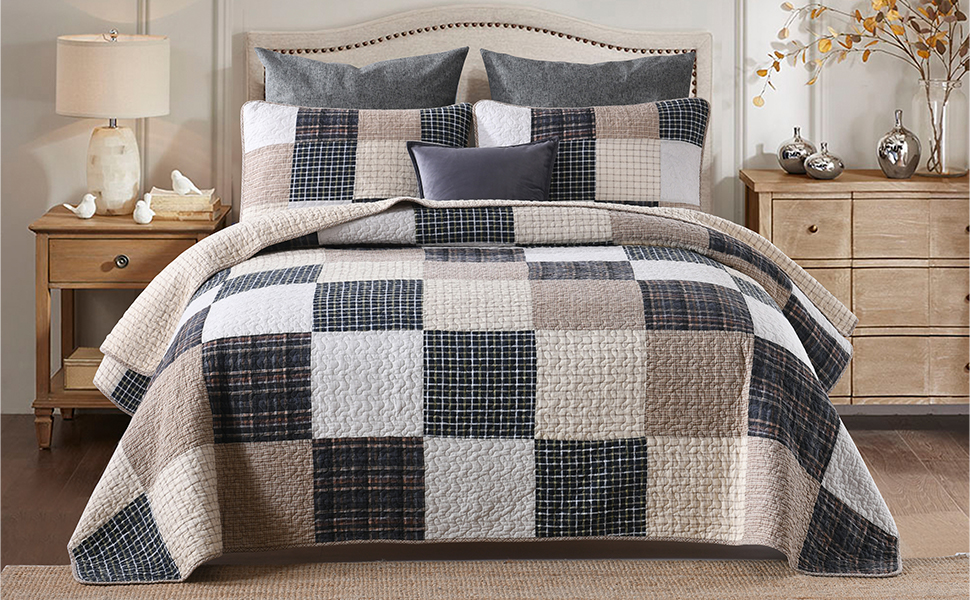
Where is `clear jar`? This screenshot has width=970, height=600. clear jar is located at coordinates (954, 133).